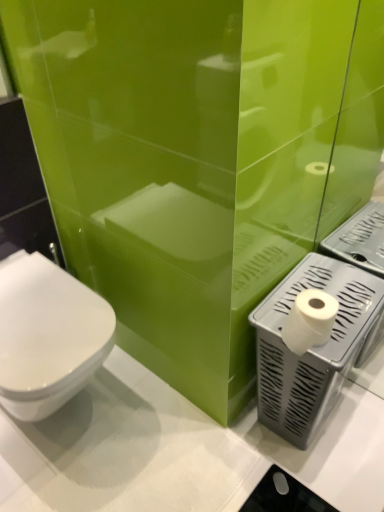
Where is `vacant area in front of gray plastic toilet paper holder at lower right`? The image size is (384, 512). vacant area in front of gray plastic toilet paper holder at lower right is located at coordinates (312, 477).